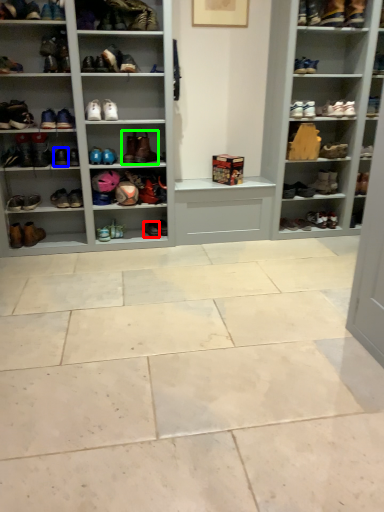
Question: Considering the real-world distances, which object is farthest from shoe (highlighted by a red box)? shoe (highlighted by a blue box) or footwear (highlighted by a green box)?

Choices:
 (A) shoe
 (B) footwear

Answer: (A)